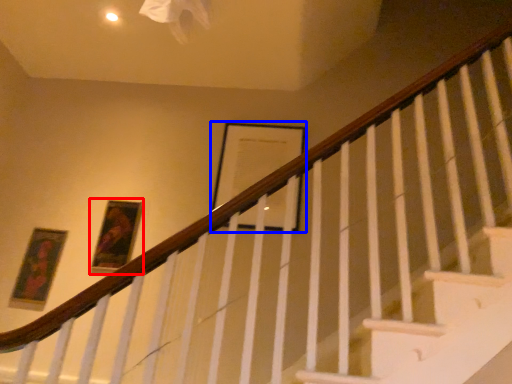
Question: Among these objects, which one is nearest to the camera, picture frame (highlighted by a red box) or picture frame (highlighted by a blue box)?

Choices:
 (A) picture frame
 (B) picture frame

Answer: (A)